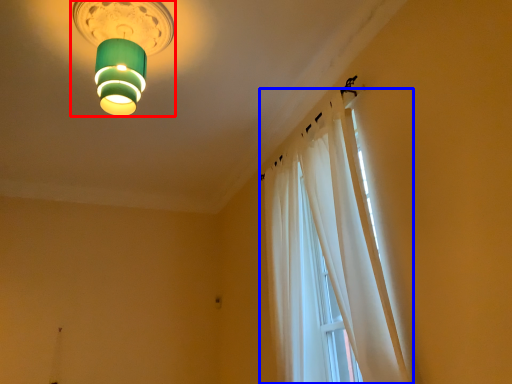
Question: Which point is closer to the camera, lamp (highlighted by a red box) or curtain (highlighted by a blue box)?

Choices:
 (A) lamp
 (B) curtain

Answer: (B)